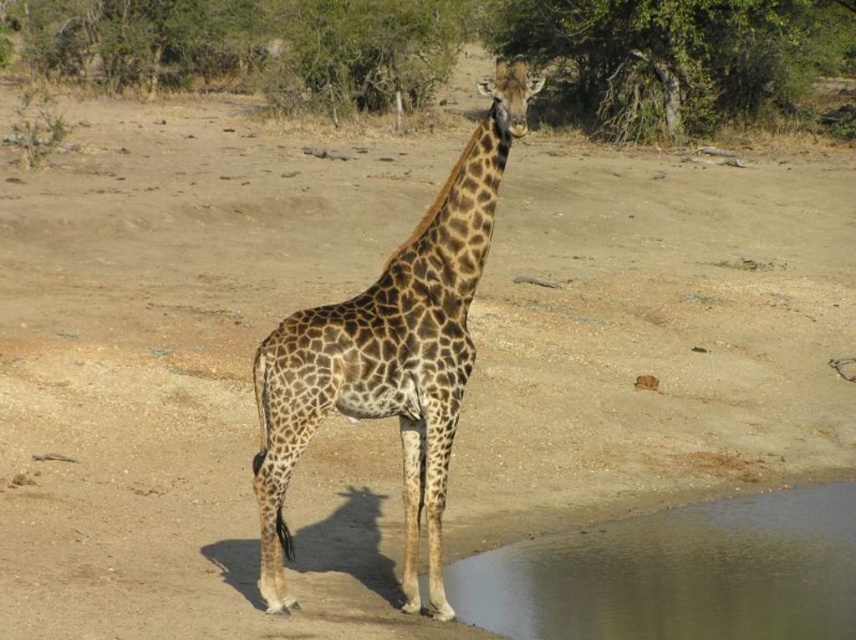
You are a wildlife photographer trying to capture a photo of the spotted fur giraffe at center and transparent water at lower right. Based on their sizes, which one would appear larger in the photo?

The spotted fur giraffe at center might appear larger in the photo than the transparent water at lower right because it might be wider than the transparent water at lower right.

You are a wildlife photographer trying to capture a photo of the spotted fur giraffe at center and the transparent water at lower right. Which object will appear bigger in your photo?

The spotted fur giraffe at center will appear bigger in the photo because it has a larger size compared to the transparent water at lower right.